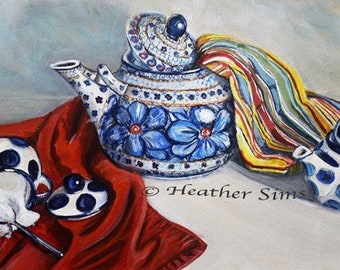
Where is `table`? The width and height of the screenshot is (340, 270). table is located at coordinates (230, 244).